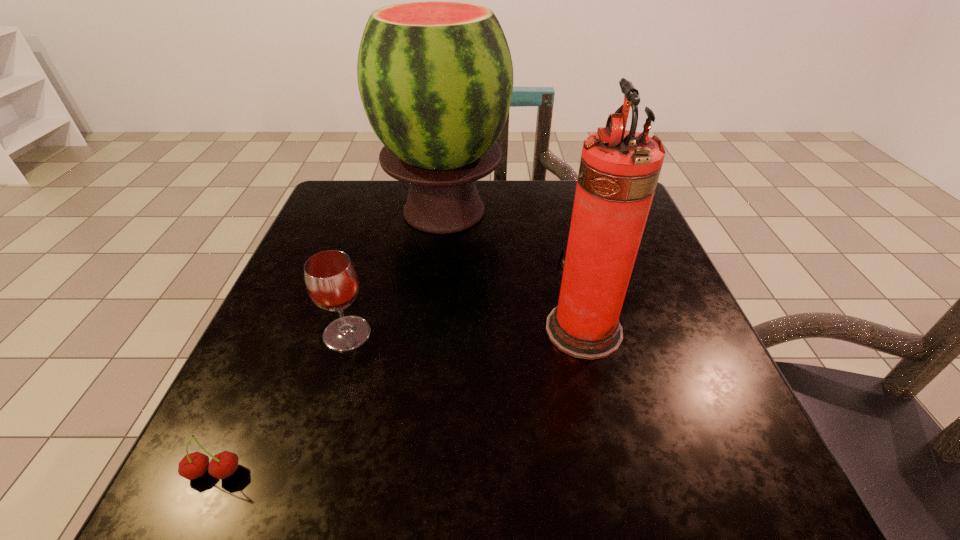
At what (x,y) coordinates should I click in order to perform the action: click on object present at the far edge. Please return your answer as a coordinate pair (x, y). The image size is (960, 540). Looking at the image, I should click on (435, 78).

Where is `object located in the near edge section of the desktop`? The image size is (960, 540). object located in the near edge section of the desktop is located at coordinates [194, 465].

Image resolution: width=960 pixels, height=540 pixels. In order to click on watermelon located at the left edge in this screenshot , I will do `click(435, 78)`.

I want to click on wineglass at the left edge, so click(331, 280).

Find the location of `cherry at the left edge`. cherry at the left edge is located at coordinates (194, 465).

The width and height of the screenshot is (960, 540). In order to click on object at the right edge in this screenshot , I will do `click(619, 169)`.

Locate an element on the screen. object present at the far left corner is located at coordinates (435, 78).

The height and width of the screenshot is (540, 960). In order to click on object present at the near left corner in this screenshot , I will do `click(194, 465)`.

Where is `blank area at the far edge`? The width and height of the screenshot is (960, 540). blank area at the far edge is located at coordinates (402, 219).

I want to click on vacant space at the near edge of the desktop, so click(375, 457).